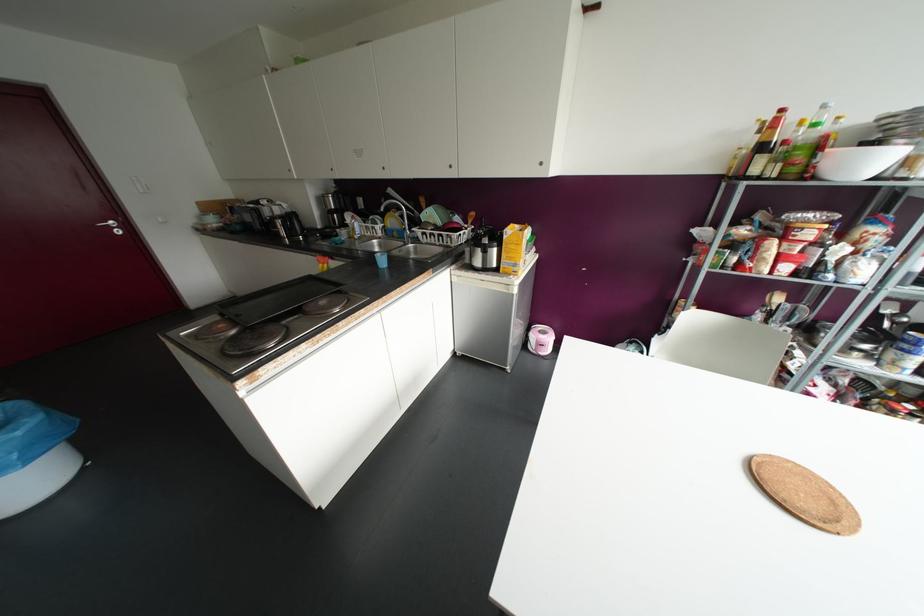
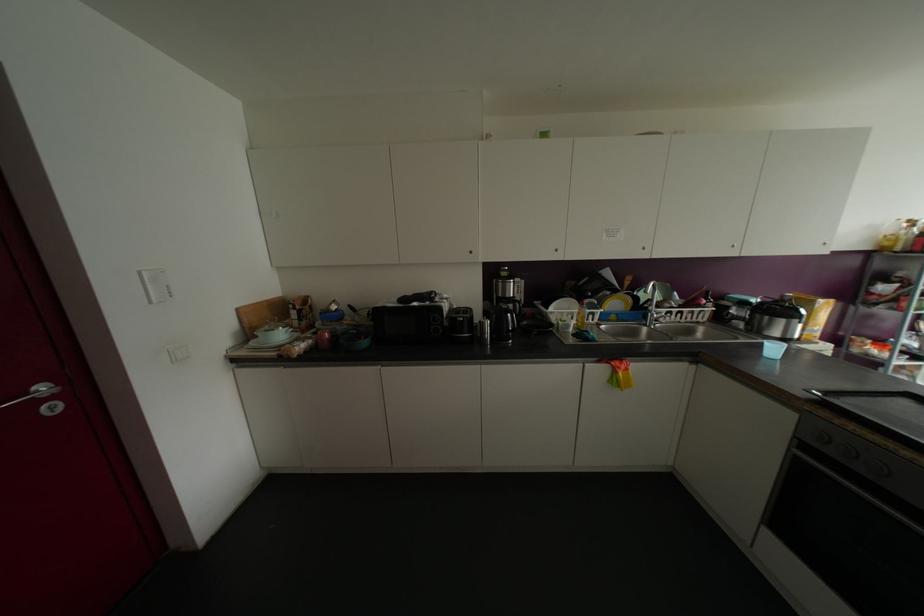
In the second image, find the point that corresponds to point (392, 221) in the first image.

(614, 302)